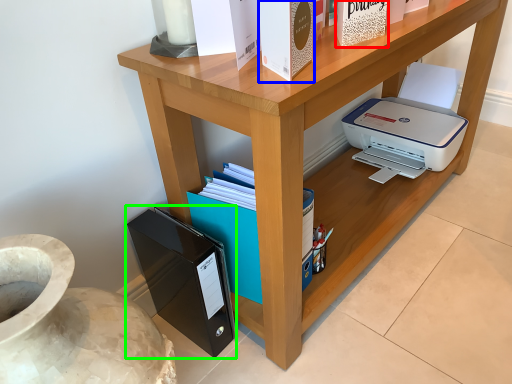
Question: Which is farther away from paperback book (highlighted by a red box)? paperback book (highlighted by a blue box) or paperback book (highlighted by a green box)?

Choices:
 (A) paperback book
 (B) paperback book

Answer: (B)